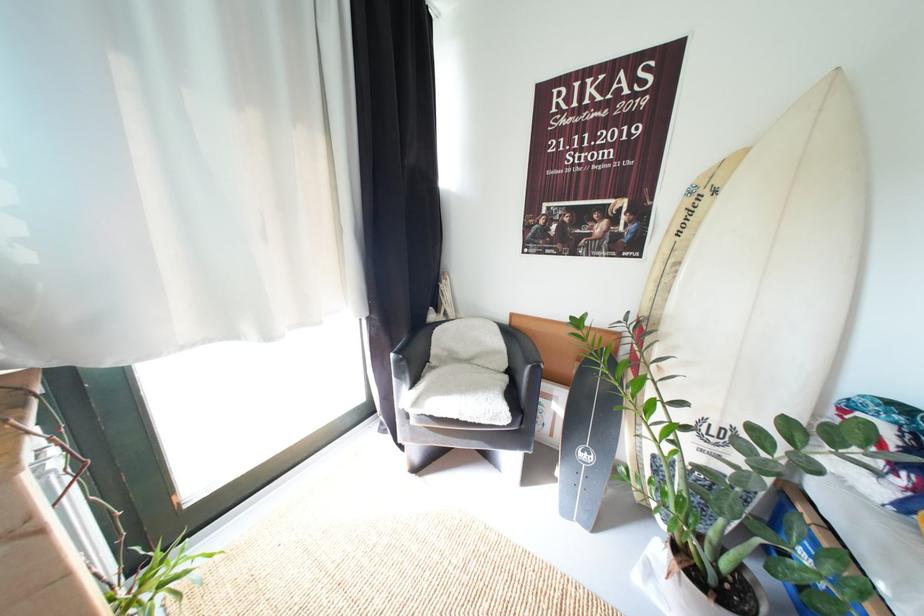
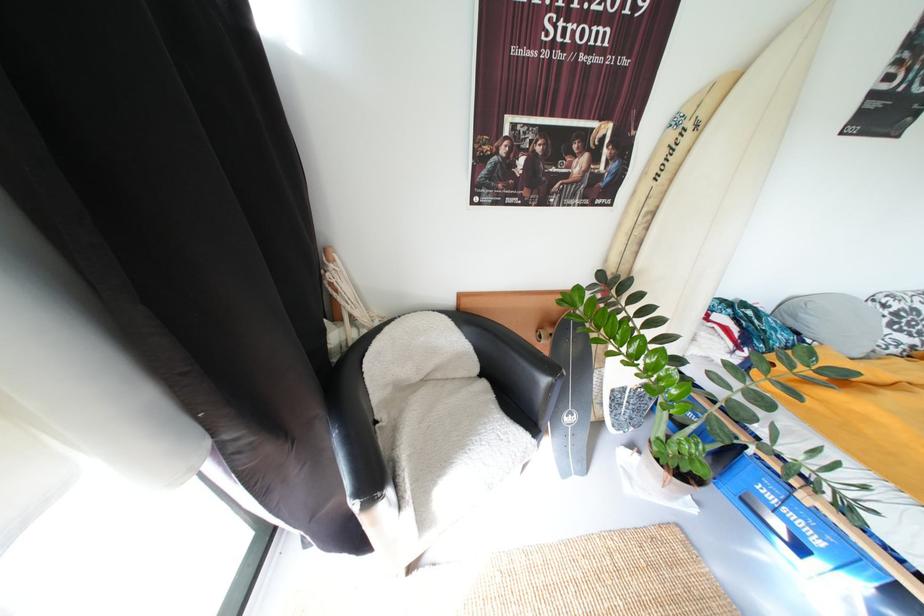
Based on the continuous images, in which direction is the camera rotating?

The rotation direction of the camera is right-down.